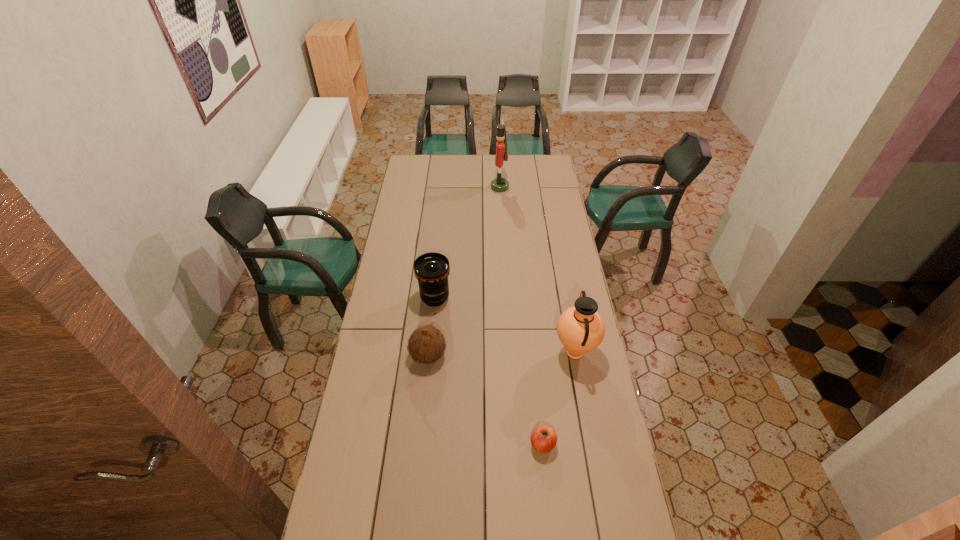
At what (x,y) coordinates should I click in order to perform the action: click on unoccupied area between the rightmost object and the telephoto lens. Please return your answer as a coordinate pair (x, y). The height and width of the screenshot is (540, 960). Looking at the image, I should click on (505, 326).

This screenshot has height=540, width=960. I want to click on free space that is in between the nutcracker and the coconut, so click(x=464, y=272).

Where is `free spot between the nearest object and the telephoto lens`? The width and height of the screenshot is (960, 540). free spot between the nearest object and the telephoto lens is located at coordinates (489, 372).

What are the coordinates of `free space between the coconut and the nearest object` in the screenshot? It's located at 486,400.

Find the location of a particular element. object that is the third closest to the coconut is located at coordinates [x=580, y=328].

Identify which object is located as the nearest to the coconut. Please provide its 2D coordinates. Your answer should be formatted as a tuple, i.e. [(x, y)], where the tuple contains the x and y coordinates of a point satisfying the conditions above.

[(432, 269)]

The image size is (960, 540). Find the location of `vacant space that satisfies the following two spatial constraints: 1. on the front-facing side of the nutcracker; 2. on the front side of the telephoto lens`. vacant space that satisfies the following two spatial constraints: 1. on the front-facing side of the nutcracker; 2. on the front side of the telephoto lens is located at coordinates (506, 298).

Image resolution: width=960 pixels, height=540 pixels. What are the coordinates of `vacant space that satisfies the following two spatial constraints: 1. on the front-facing side of the nutcracker; 2. on the left side of the pitcher` in the screenshot? It's located at (509, 353).

This screenshot has width=960, height=540. I want to click on vacant region that satisfies the following two spatial constraints: 1. on the front-facing side of the nutcracker; 2. on the right side of the pitcher, so click(x=509, y=353).